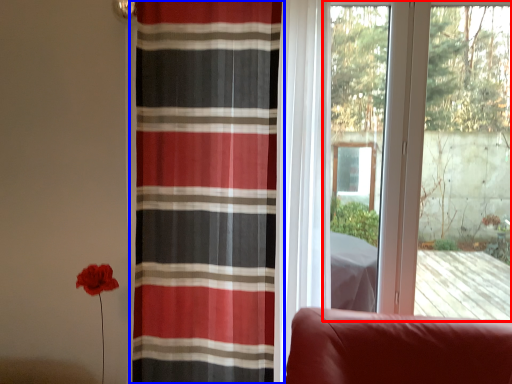
Question: Which point is further to the camera, window (highlighted by a red box) or curtain (highlighted by a blue box)?

Choices:
 (A) window
 (B) curtain

Answer: (A)